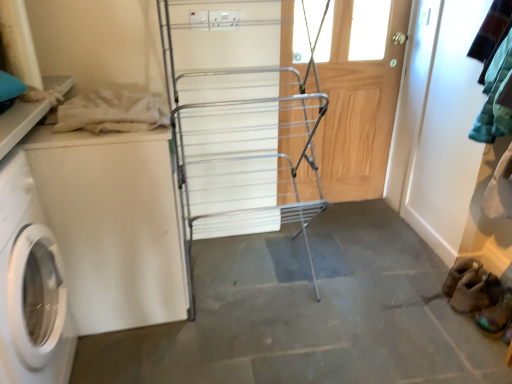
The image size is (512, 384). What do you see at coordinates (30, 285) in the screenshot? I see `white matte washing machine at left, placed as the first washing machine when sorted from left to right` at bounding box center [30, 285].

The width and height of the screenshot is (512, 384). Describe the element at coordinates (110, 113) in the screenshot. I see `beige cotton cloth at upper left` at that location.

At what (x,y) coordinates should I click in order to perform the action: click on brown suede shoe at lower right, arranged as the first shoe when viewed from the back. Please return your answer as a coordinate pair (x, y). This screenshot has height=384, width=512. Looking at the image, I should click on (476, 291).

What is the approximate width of brown suede shoe at lower right, arranged as the first shoe when viewed from the back?

brown suede shoe at lower right, arranged as the first shoe when viewed from the back, is 10.77 inches wide.

The height and width of the screenshot is (384, 512). In order to click on wooden screen door at center in this screenshot , I will do `click(358, 110)`.

In terms of height, does wooden screen door at center look taller or shorter compared to white matte washing machine at left, which is the first washing machine from right to left?

Considering their sizes, wooden screen door at center has more height than white matte washing machine at left, which is the first washing machine from right to left.

Is wooden screen door at center thinner than white matte washing machine at left, which is the second washing machine from left to right?

Correct, the width of wooden screen door at center is less than that of white matte washing machine at left, which is the second washing machine from left to right.

From a real-world perspective, is wooden screen door at center above or below white matte washing machine at left, which is the first washing machine from right to left?

From a real-world perspective, wooden screen door at center is physically above white matte washing machine at left, which is the first washing machine from right to left.

Which is behind, wooden screen door at center or white matte washing machine at left, which is the first washing machine from right to left?

wooden screen door at center is further from the camera.

Is wooden screen door at center turned away from beige cotton cloth at upper left?

wooden screen door at center does not have its back to beige cotton cloth at upper left.

Based on the photo, which object is closer to the camera, wooden screen door at center or beige cotton cloth at upper left?

beige cotton cloth at upper left.

Is wooden screen door at center to the right of beige cotton cloth at upper left from the viewer's perspective?

Yes.

From the image's perspective, which is above, wooden screen door at center or beige cotton cloth at upper left?

wooden screen door at center, from the image's perspective.

Considering the positions of objects wooden screen door at center and brown suede shoe at lower right, the 1th shoe in the front-to-back sequence, in the image provided, who is more to the left, wooden screen door at center or brown suede shoe at lower right, the 1th shoe in the front-to-back sequence,?

wooden screen door at center.

Is point (374, 170) positioned in front of point (496, 324)?

No, (374, 170) is behind (496, 324).

Where is `the 2nd shoe positioned below the wooden screen door at center (from a real-world perspective)`? the 2nd shoe positioned below the wooden screen door at center (from a real-world perspective) is located at coordinates (496, 314).

Is brown suede shoe at lower right, the second shoe positioned from the front, thinner than wooden screen door at center?

In fact, brown suede shoe at lower right, the second shoe positioned from the front, might be wider than wooden screen door at center.

From the image's perspective, who appears lower, brown suede shoe at lower right, arranged as the first shoe when viewed from the back, or wooden screen door at center?

From the image's view, brown suede shoe at lower right, arranged as the first shoe when viewed from the back, is below.

Considering the sizes of objects brown suede shoe at lower right, the second shoe positioned from the front, and wooden screen door at center in the image provided, who is taller, brown suede shoe at lower right, the second shoe positioned from the front, or wooden screen door at center?

wooden screen door at center.

Considering the positions of objects brown suede shoe at lower right, the second shoe positioned from the front, and wooden screen door at center in the image provided, who is in front, brown suede shoe at lower right, the second shoe positioned from the front, or wooden screen door at center?

brown suede shoe at lower right, the second shoe positioned from the front, is in front.

Considering the relative sizes of brown suede shoe at lower right, which ranks as the second shoe in back-to-front order, and white matte washing machine at left, which is counted as the 2th washing machine, starting from the right, in the image provided, is brown suede shoe at lower right, which ranks as the second shoe in back-to-front order, thinner than white matte washing machine at left, which is counted as the 2th washing machine, starting from the right,?

Indeed, brown suede shoe at lower right, which ranks as the second shoe in back-to-front order, has a lesser width compared to white matte washing machine at left, which is counted as the 2th washing machine, starting from the right.

Is brown suede shoe at lower right, the 1th shoe in the front-to-back sequence, taller than white matte washing machine at left, placed as the first washing machine when sorted from left to right?

No.

Is the surface of brown suede shoe at lower right, the 1th shoe in the front-to-back sequence, in direct contact with white matte washing machine at left, which is counted as the 2th washing machine, starting from the right?

No, brown suede shoe at lower right, the 1th shoe in the front-to-back sequence, is not next to white matte washing machine at left, which is counted as the 2th washing machine, starting from the right.

Choose the correct answer: Is brown suede shoe at lower right, the 1th shoe in the front-to-back sequence, inside white matte washing machine at left, which is counted as the 2th washing machine, starting from the right, or outside it?

brown suede shoe at lower right, the 1th shoe in the front-to-back sequence, is spatially situated outside white matte washing machine at left, which is counted as the 2th washing machine, starting from the right.

Is beige cotton cloth at upper left next to wooden screen door at center?

No, beige cotton cloth at upper left is not beside wooden screen door at center.

Looking at this image, from the image's perspective, is beige cotton cloth at upper left located beneath wooden screen door at center?

Yes, from the image's perspective, beige cotton cloth at upper left is below wooden screen door at center.

Relative to wooden screen door at center, is beige cotton cloth at upper left in front or behind?

Visually, beige cotton cloth at upper left is located in front of wooden screen door at center.

Is beige cotton cloth at upper left to the right of wooden screen door at center from the viewer's perspective?

In fact, beige cotton cloth at upper left is to the left of wooden screen door at center.

Can you confirm if wooden screen door at center is wider than white matte washing machine at left, placed as the first washing machine when sorted from left to right?

Incorrect, the width of wooden screen door at center does not surpass that of white matte washing machine at left, placed as the first washing machine when sorted from left to right.

From the image's perspective, between wooden screen door at center and white matte washing machine at left, placed as the first washing machine when sorted from left to right, which one is located above?

wooden screen door at center.

From the picture: From a real-world perspective, is wooden screen door at center physically below white matte washing machine at left, which is counted as the 2th washing machine, starting from the right?

No.

The height and width of the screenshot is (384, 512). Identify the location of screen door that is on the right side of white matte washing machine at left, which is the second washing machine from left to right. (358, 110).

Locate an element on the screen. This screenshot has width=512, height=384. clothing in front of the wooden screen door at center is located at coordinates (110, 113).

From the image, which object appears to be nearer to silver metallic drying rack at center, white matte washing machine at left, which is the first washing machine from right to left, or brown suede shoe at lower right, arranged as the first shoe when viewed from the back?

white matte washing machine at left, which is the first washing machine from right to left, is positioned closer to the anchor silver metallic drying rack at center.

Considering their positions, is brown suede shoe at lower right, the 1th shoe in the front-to-back sequence, positioned further to wooden screen door at center than white matte washing machine at left, which is the second washing machine from left to right?

white matte washing machine at left, which is the second washing machine from left to right, lies further to wooden screen door at center than the other object.

From the image, which object appears to be nearer to silver metallic drying rack at center, brown suede shoe at lower right, arranged as the first shoe when viewed from the back, or white matte washing machine at left, placed as the first washing machine when sorted from left to right?

white matte washing machine at left, placed as the first washing machine when sorted from left to right, lies closer to silver metallic drying rack at center than the other object.

From the image, which object appears to be nearer to silver metallic drying rack at center, brown suede shoe at lower right, arranged as the first shoe when viewed from the back, or wooden screen door at center?

wooden screen door at center is closer to silver metallic drying rack at center.

Considering their positions, is white matte washing machine at left, which is the second washing machine from left to right, positioned closer to beige cotton cloth at upper left than white matte washing machine at left, placed as the first washing machine when sorted from left to right?

Among the two, white matte washing machine at left, which is the second washing machine from left to right, is located nearer to beige cotton cloth at upper left.

When comparing their distances from beige cotton cloth at upper left, does brown suede shoe at lower right, the 1th shoe in the front-to-back sequence, or wooden screen door at center seem further?

brown suede shoe at lower right, the 1th shoe in the front-to-back sequence, is further to beige cotton cloth at upper left.

Which object lies further to the anchor point gray concrete floor at center, beige cotton cloth at upper left or brown suede shoe at lower right, arranged as the first shoe when viewed from the back?

beige cotton cloth at upper left is positioned further to the anchor gray concrete floor at center.

Based on their spatial positions, is beige cotton cloth at upper left or white matte washing machine at left, which is the second washing machine from left to right, further from brown suede shoe at lower right, the 1th shoe in the front-to-back sequence?

beige cotton cloth at upper left is further to brown suede shoe at lower right, the 1th shoe in the front-to-back sequence.

I want to click on trolley between beige cotton cloth at upper left and brown suede shoe at lower right, arranged as the first shoe when viewed from the back, from left to right, so click(x=238, y=121).

The image size is (512, 384). I want to click on clothing between white matte washing machine at left, which is counted as the 2th washing machine, starting from the right, and gray concrete floor at center, so click(110, 113).

Identify the location of trolley located between beige cotton cloth at upper left and brown suede shoe at lower right, which ranks as the second shoe in back-to-front order, in the left-right direction. (238, 121).

Where is `washing machine between white matte washing machine at left, which is counted as the 2th washing machine, starting from the right, and gray concrete floor at center, in the horizontal direction`? This screenshot has width=512, height=384. washing machine between white matte washing machine at left, which is counted as the 2th washing machine, starting from the right, and gray concrete floor at center, in the horizontal direction is located at coordinates (113, 224).